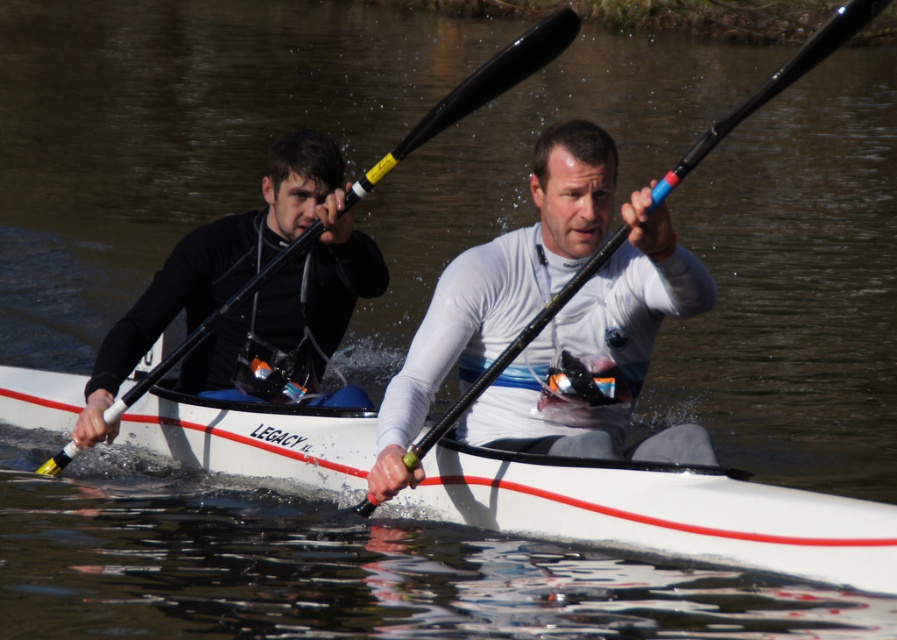
You are a photographer trying to capture a clear shot of the matte black wetsuit at left and the black rubber paddle at center. Since you want to focus on the paddle, which object should you position closer to the camera to ensure the paddle is in focus?

The black rubber paddle at center is behind the matte black wetsuit at left, so to focus on the paddle, you should position the black rubber paddle at center closer to the camera than the matte black wetsuit at left.

You are planning to store the white matte kayak at center and the black rubber paddle at center in a storage unit. The storage unit has a maximum height limit of 1 meter. Can you fit both items vertically without exceeding the height limit?

The white matte kayak at center has a smaller size compared to black rubber paddle at center. However, the exact dimensions of both items are not provided. Therefore, it is impossible to determine if they can fit vertically within the 1 meter height limit without additional information about their lengths.